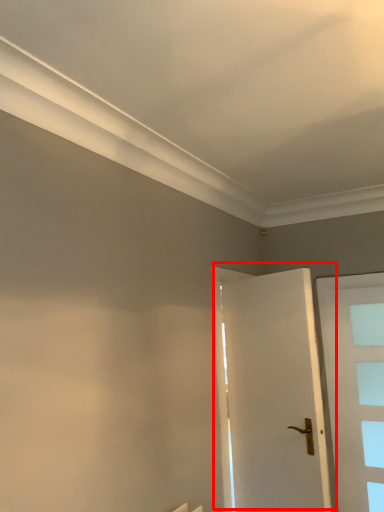
Question: From the image's perspective, what is the correct spatial positioning of door (annotated by the red box) in reference to door?

Choices:
 (A) above
 (B) below

Answer: (A)